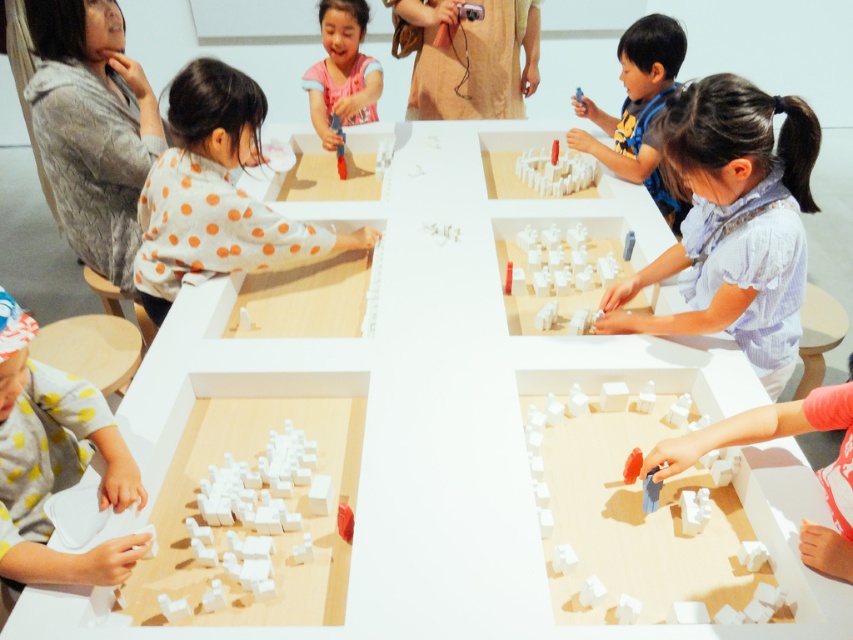
Does blue plastic toy at lower right lie in front of matte orange toy at lower right?

Yes.

Does point (720, 420) come behind point (639, 449)?

Yes, point (720, 420) is behind point (639, 449).

Does point (820, 406) come in front of point (625, 468)?

Yes, it is.

The width and height of the screenshot is (853, 640). What are the coordinates of `blue plastic toy at lower right` in the screenshot? It's located at (775, 436).

Does white matte shirt at upper left have a larger size compared to blue fabric shirt at upper right?

Yes, white matte shirt at upper left is bigger than blue fabric shirt at upper right.

Consider the image. Who is shorter, white matte shirt at upper left or blue fabric shirt at upper right?

blue fabric shirt at upper right

Between point (196, 193) and point (579, 109), which one is positioned in front?

Positioned in front is point (196, 193).

The width and height of the screenshot is (853, 640). Identify the location of white matte shirt at upper left. (216, 195).

Is white matte figure at center bigger than matte pink shirt at upper center?

Indeed, white matte figure at center has a larger size compared to matte pink shirt at upper center.

Where is `white matte figure at center`? The image size is (853, 640). white matte figure at center is located at coordinates (733, 221).